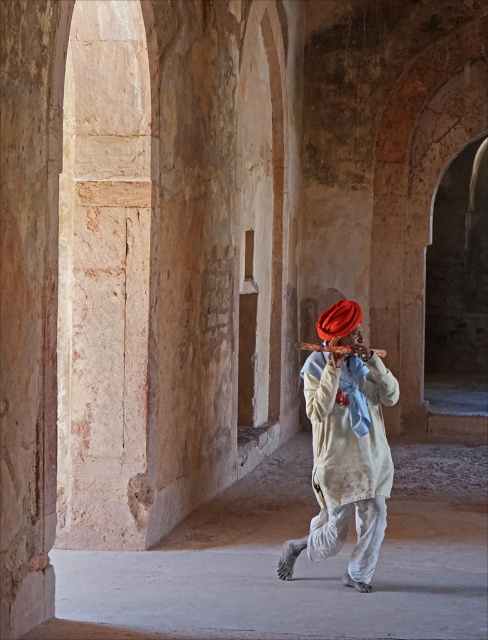
Question: Which point is farther from the camera taking this photo?

Choices:
 (A) (370, 531)
 (B) (350, 310)

Answer: (A)

Question: Does matte white fabric at center have a smaller size compared to shiny orange turban at center?

Choices:
 (A) yes
 (B) no

Answer: (B)

Question: Does matte white fabric at center have a smaller size compared to shiny orange turban at center?

Choices:
 (A) no
 (B) yes

Answer: (A)

Question: Which of the following is the farthest from the observer?

Choices:
 (A) click(x=360, y=582)
 (B) click(x=342, y=326)

Answer: (A)

Question: Which point is farther from the camera taking this photo?

Choices:
 (A) (346, 317)
 (B) (347, 328)

Answer: (A)

Question: Is matte white fabric at center to the left of shiny orange turban at center from the viewer's perspective?

Choices:
 (A) no
 (B) yes

Answer: (B)